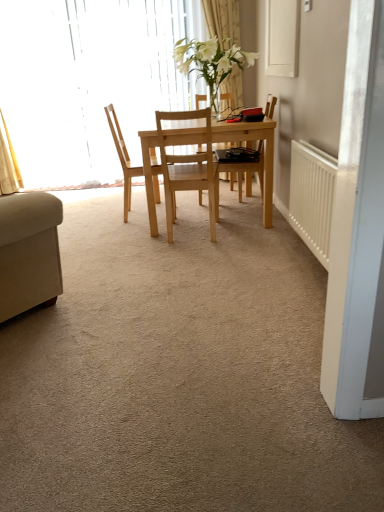
Question: From a real-world perspective, is natural wood chair at center, the 1th chair when ordered from left to right, on light wood table at center?

Choices:
 (A) yes
 (B) no

Answer: (A)

Question: Could you tell me if natural wood chair at center, the second chair when ordered from right to left, is turned towards light wood table at center?

Choices:
 (A) yes
 (B) no

Answer: (A)

Question: From the image's perspective, is natural wood chair at center, the 1th chair when ordered from left to right, under light wood table at center?

Choices:
 (A) no
 (B) yes

Answer: (A)

Question: Is light wood table at center located within natural wood chair at center, the second chair when ordered from right to left?

Choices:
 (A) no
 (B) yes

Answer: (A)

Question: Does natural wood chair at center, the second chair when ordered from right to left, have a smaller size compared to light wood table at center?

Choices:
 (A) no
 (B) yes

Answer: (B)

Question: Does natural wood chair at center, the second chair when ordered from right to left, have a greater height compared to light wood table at center?

Choices:
 (A) yes
 (B) no

Answer: (A)

Question: Is white plastic radiator at right looking in the opposite direction of white glossy vase at center?

Choices:
 (A) no
 (B) yes

Answer: (A)

Question: Can you confirm if white plastic radiator at right is positioned to the left of white glossy vase at center?

Choices:
 (A) no
 (B) yes

Answer: (A)

Question: From a real-world perspective, does white plastic radiator at right stand above white glossy vase at center?

Choices:
 (A) no
 (B) yes

Answer: (A)

Question: Does white plastic radiator at right turn towards white glossy vase at center?

Choices:
 (A) no
 (B) yes

Answer: (A)

Question: Does white plastic radiator at right have a smaller size compared to white glossy vase at center?

Choices:
 (A) yes
 (B) no

Answer: (A)

Question: Does white plastic radiator at right lie in front of white glossy vase at center?

Choices:
 (A) no
 (B) yes

Answer: (B)

Question: Considering the relative positions of natural wood chair at center, the second chair when ordered from right to left, and white sheer curtain at upper center in the image provided, is natural wood chair at center, the second chair when ordered from right to left, to the left of white sheer curtain at upper center from the viewer's perspective?

Choices:
 (A) yes
 (B) no

Answer: (A)